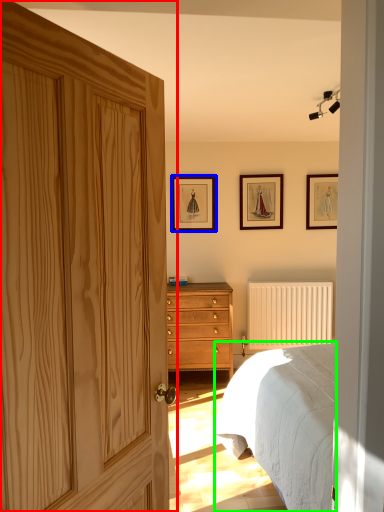
Question: Estimate the real-world distances between objects in this image. Which object is closer to door (highlighted by a red box), picture frame (highlighted by a blue box) or bed (highlighted by a green box)?

Choices:
 (A) picture frame
 (B) bed

Answer: (B)